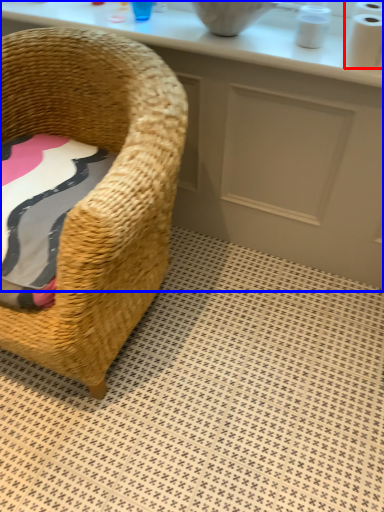
Question: Which point is closer to the camera, toilet paper (highlighted by a red box) or counter (highlighted by a blue box)?

Choices:
 (A) toilet paper
 (B) counter

Answer: (A)